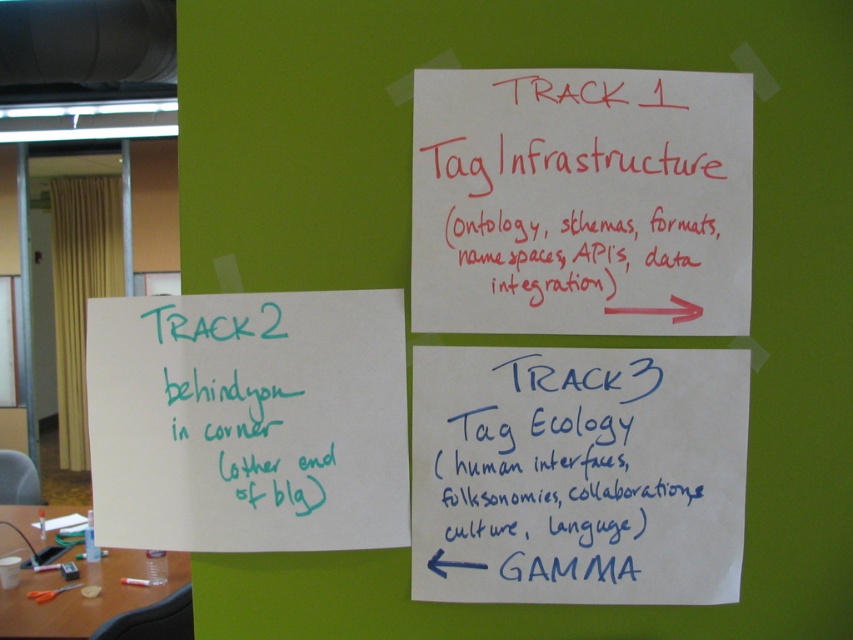
What is the location of the point labeled with coordinates [581,202] on the white paper at upper center?

The point labeled with coordinates [581,202] is located on the white paper at upper center.

Consider the image. You are organizing a workshop and need to arrange the papers on the wall. You have a blue handwritten paper at lower right and a green handwritten note at lower left. Which paper should you place on the left side of the wall to ensure proper alignment with the existing setup?

The green handwritten note at lower left should be placed on the left side of the wall because it is already positioned to the left of the blue handwritten paper at lower right in the current setup.